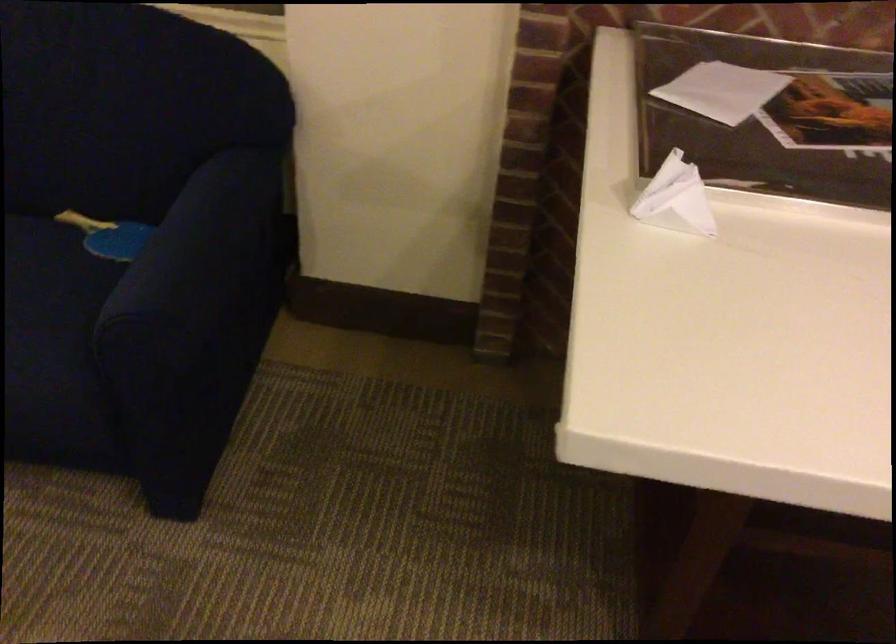
What do you see at coordinates (197, 287) in the screenshot?
I see `the blue sofa armrest` at bounding box center [197, 287].